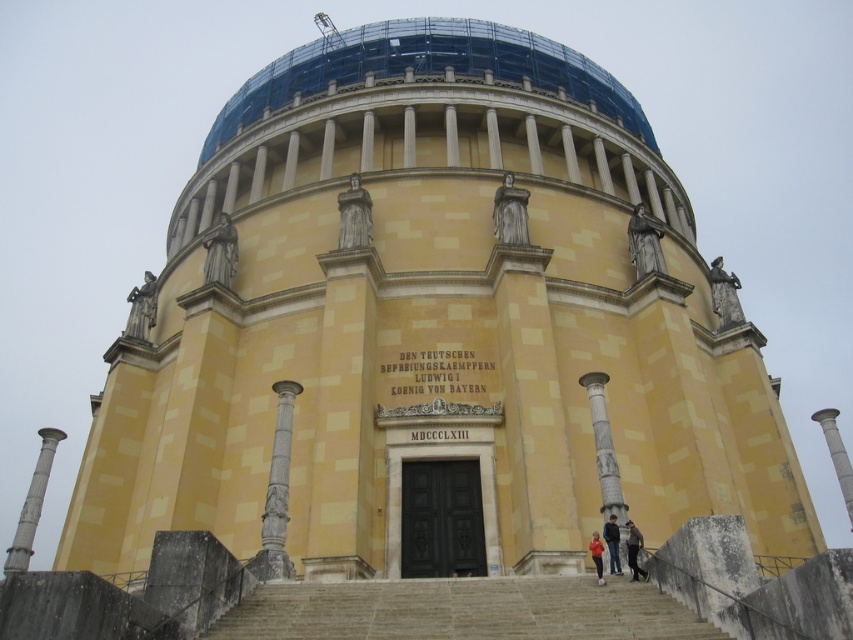
Question: Is white marble column at center smaller than white marble column at lower left?

Choices:
 (A) no
 (B) yes

Answer: (B)

Question: Which object appears closest to the camera in this image?

Choices:
 (A) dark blue jeans at lower center
 (B) stone stairs at center
 (C) white marble column at right

Answer: (B)

Question: Which point is farther to the camera?

Choices:
 (A) blue denim jeans at lower center
 (B) white marble column at right
 (C) transparent glass dome at upper center

Answer: (C)

Question: Is white marble column at center thinner than blue denim jeans at lower center?

Choices:
 (A) no
 (B) yes

Answer: (A)

Question: Estimate the real-world distances between objects in this image. Which object is farther from the blue denim jeans at lower center?

Choices:
 (A) white marble column at center
 (B) white marble column at lower left
 (C) dark blue jeans at lower center

Answer: (B)

Question: Is transparent glass dome at upper center thinner than white marble column at right?

Choices:
 (A) no
 (B) yes

Answer: (B)